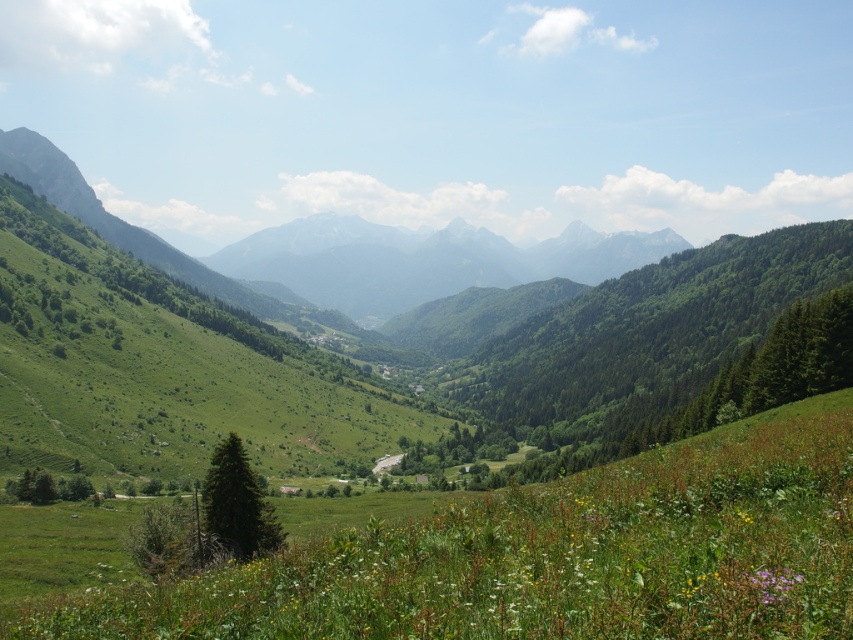
Between point (432, 262) and point (228, 499), which one is positioned behind?

Point (432, 262)

Between point (373, 250) and point (241, 440), which one is positioned in front?

Point (241, 440) is in front.

Who is more forward, [509,278] or [207,529]?

Point [207,529] is more forward.

Where is `green grassy mountain at center`? The width and height of the screenshot is (853, 640). green grassy mountain at center is located at coordinates (422, 260).

Can you confirm if green leafy tree at center is thinner than purple matte flower at lower right?

In fact, green leafy tree at center might be wider than purple matte flower at lower right.

Does green leafy tree at center appear over purple matte flower at lower right?

Yes.

The width and height of the screenshot is (853, 640). Find the location of `green leafy tree at center`. green leafy tree at center is located at coordinates (645, 340).

Find the location of a particular element. The width and height of the screenshot is (853, 640). green leafy tree at center is located at coordinates (645, 340).

Who is positioned more to the right, green matte tree at lower left or purple matte flower at lower right?

purple matte flower at lower right

In the scene shown: Is green matte tree at lower left positioned at the back of purple matte flower at lower right?

Yes, green matte tree at lower left is behind purple matte flower at lower right.

Who is more forward, (229, 515) or (770, 580)?

Positioned in front is point (770, 580).

Find the location of a particular element. The height and width of the screenshot is (640, 853). green matte tree at lower left is located at coordinates (236, 502).